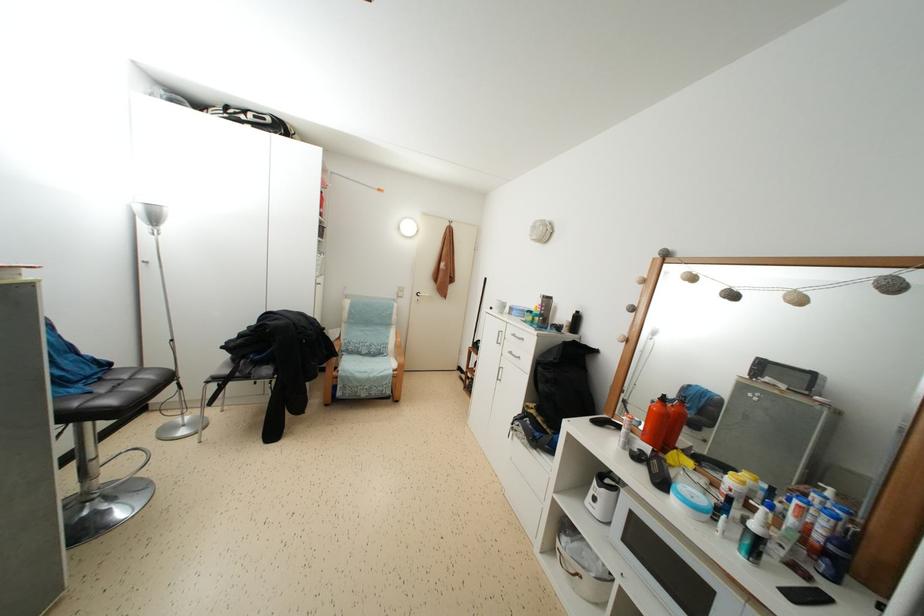
Find where to sit the gray chair sitting surface. Please return your answer as a coordinate pair (x, y).

(379, 362)